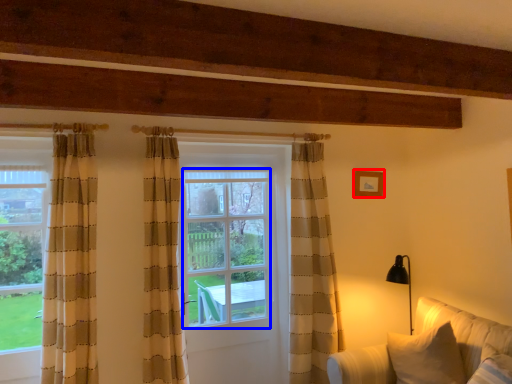
Question: Which point is further to the camera, picture frame (highlighted by a red box) or window screen (highlighted by a blue box)?

Choices:
 (A) picture frame
 (B) window screen

Answer: (A)